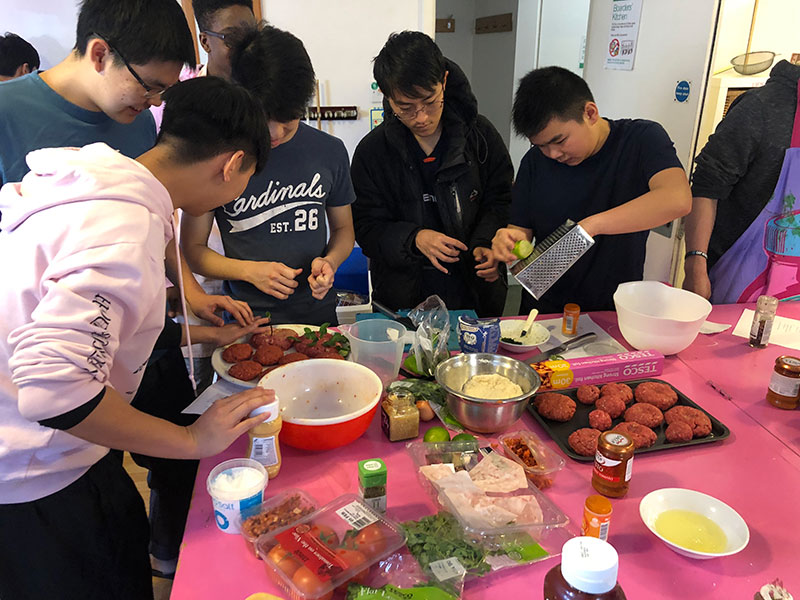
I want to click on pink table, so click(746, 470).